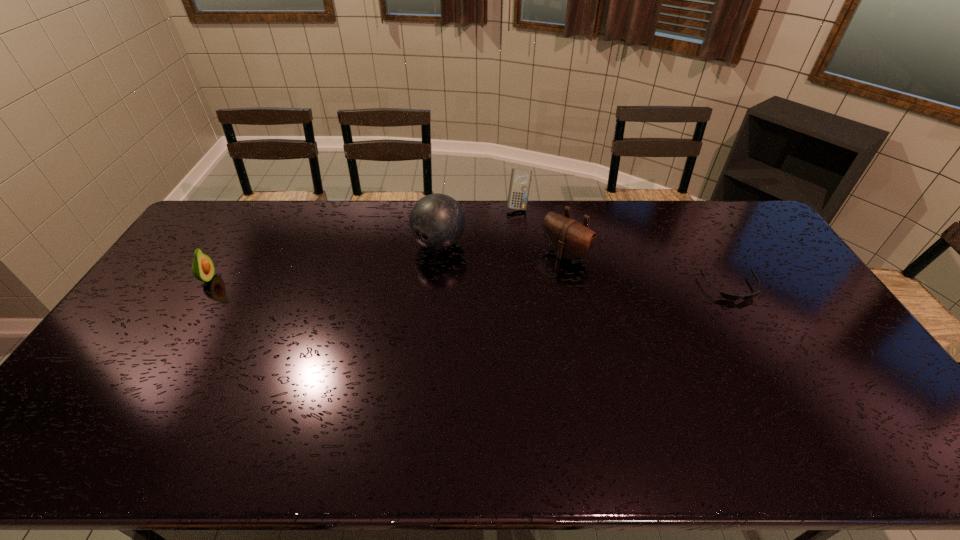
At what (x,y) coordinates should I click in order to perform the action: click on vacant point located 0.150m on the front-facing side of the rightmost object. Please return your answer as a coordinate pair (x, y). This screenshot has width=960, height=540. Looking at the image, I should click on [x=761, y=341].

Where is `vacant space located on the grip area of the bowling ball`? vacant space located on the grip area of the bowling ball is located at coordinates (396, 282).

I want to click on vacant area situated 0.340m on the grip area of the bowling ball, so [x=349, y=323].

At what (x,y) coordinates should I click in order to perform the action: click on vacant space situated on the grip area of the bowling ball. Please return your answer as a coordinate pair (x, y). Looking at the image, I should click on (360, 314).

This screenshot has width=960, height=540. In order to click on free space located on the front-facing side of the calculator in this screenshot , I will do `click(523, 261)`.

At what (x,y) coordinates should I click in order to perform the action: click on vacant space located on the front-facing side of the calculator. Please return your answer as a coordinate pair (x, y). Looking at the image, I should click on (526, 288).

You are a GUI agent. You are given a task and a screenshot of the screen. Output one action in this format:
    pyautogui.click(x=<x>, y=<y>)
    Task: Click on the vacant region located on the front-facing side of the calculator
    The image size is (960, 540).
    Given the screenshot: What is the action you would take?
    pyautogui.click(x=520, y=230)

Find the location of a particular element. This screenshot has height=540, width=960. vacant position located 0.170m with the flap open on the pouch is located at coordinates (520, 292).

You are a GUI agent. You are given a task and a screenshot of the screen. Output one action in this format:
    pyautogui.click(x=<x>, y=<y>)
    Task: Click on the free space located 0.200m with the flap open on the pouch
    The width and height of the screenshot is (960, 540).
    Given the screenshot: What is the action you would take?
    pyautogui.click(x=514, y=296)

Find the location of `free spot located with the flap open on the pouch`. free spot located with the flap open on the pouch is located at coordinates (489, 319).